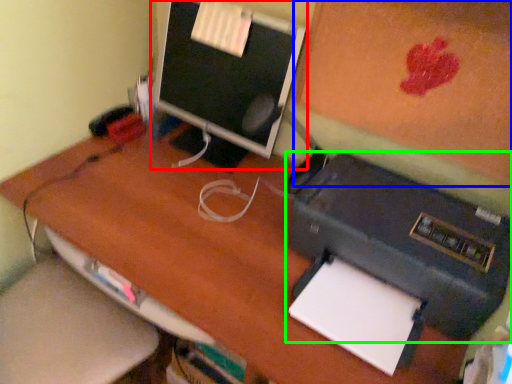
Question: Estimate the real-world distances between objects in this image. Which object is farther from computer monitor (highlighted by a red box), bulletin board (highlighted by a blue box) or printer (highlighted by a green box)?

Choices:
 (A) bulletin board
 (B) printer

Answer: (B)